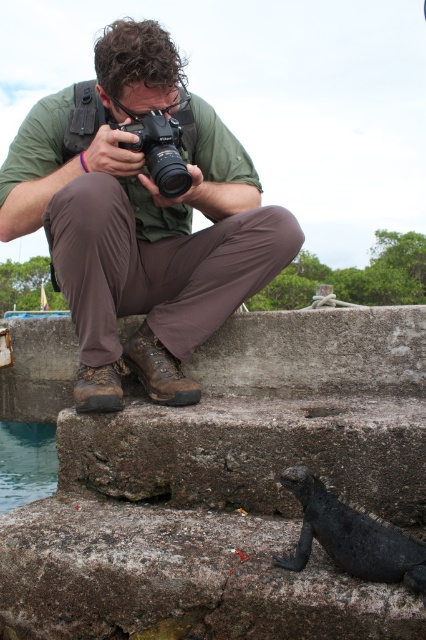
In the scene shown: You are the photographer in the scene. You want to ensure the marine iguana stays within your camera frame while taking the photo. Since the shiny black lizard at lower right is smaller than the black plastic camera at center, which object should you focus on to keep the iguana in view?

The shiny black lizard at lower right has a lesser height compared to the black plastic camera at center, so you should focus on the shiny black lizard at lower right to ensure the marine iguana stays within the camera frame.

You are the photographer in the scene. You want to ensure that both the shiny black lizard at lower right and the black plastic camera at center are fully in frame. Based on their sizes, which object might require you to zoom out more to capture it?

The shiny black lizard at lower right might require zooming out more because it might be wider than the black plastic camera at center according to the description.

You are a photographer trying to capture a closeup shot of the shiny black lizard at lower right. Your camera requires a minimum distance of 1.5 meters to avoid blurring. Based on the scene, can you safely take the photo without moving closer?

The shiny black lizard at lower right and camera are 1.40 meters apart from each other. Since the required minimum distance is 1.5 meters, the photographer cannot safely take the photo without moving closer as the current distance is insufficient.